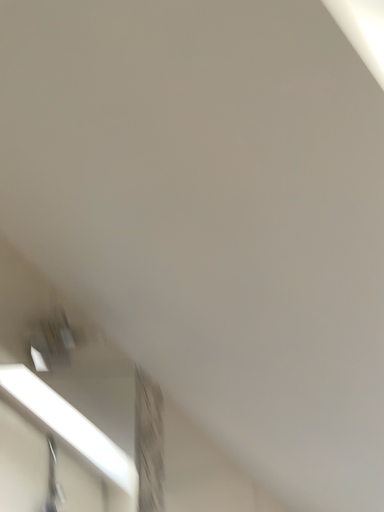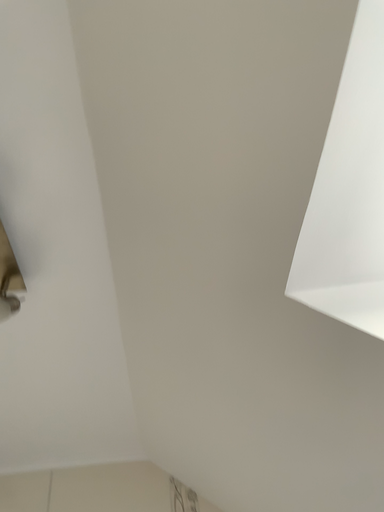
Question: How did the camera likely rotate when shooting the video?

Choices:
 (A) rotated downward
 (B) rotated upward

Answer: (B)